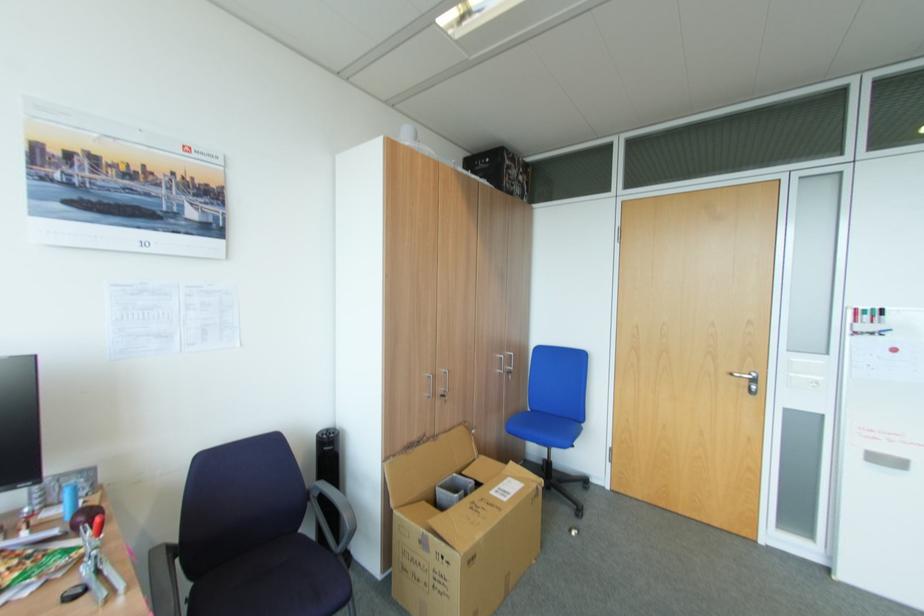
Locate an element on the screen. This screenshot has width=924, height=616. blue chair sitting surface is located at coordinates (543, 424).